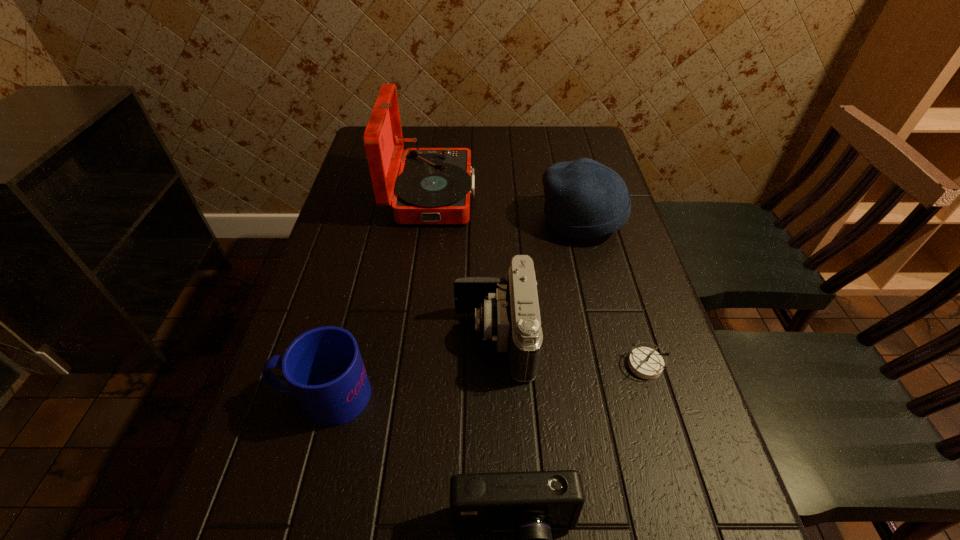
Find the location of a particular element. vacant space that satisfies the following two spatial constraints: 1. on the back side of the compass; 2. at the front of the taller camera with an open lens cover is located at coordinates (636, 338).

Locate an element on the screen. Image resolution: width=960 pixels, height=540 pixels. free point that satisfies the following two spatial constraints: 1. at the front of the compass with an open lens cover; 2. on the left side of the taller camera is located at coordinates (495, 365).

Where is `vacant point that satisfies the following two spatial constraints: 1. on the front-facing side of the phonograph_record; 2. on the right side of the skullcap`? The width and height of the screenshot is (960, 540). vacant point that satisfies the following two spatial constraints: 1. on the front-facing side of the phonograph_record; 2. on the right side of the skullcap is located at coordinates (428, 221).